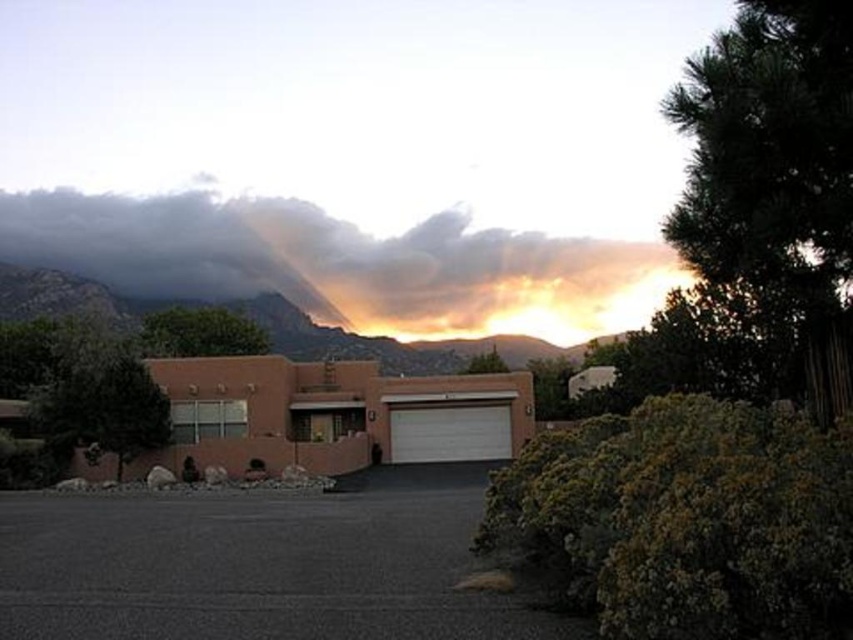
Does dark asphalt driveway at center have a larger size compared to rugged stone mountain at upper center?

No, dark asphalt driveway at center is not bigger than rugged stone mountain at upper center.

Between point (157, 561) and point (80, 292), which one is positioned behind?

Positioned behind is point (80, 292).

The width and height of the screenshot is (853, 640). Identify the location of dark asphalt driveway at center. (254, 566).

Image resolution: width=853 pixels, height=640 pixels. Find the location of `dark asphalt driveway at center`. dark asphalt driveway at center is located at coordinates (254, 566).

Is point (148, 632) farther from viewer compared to point (502, 445)?

No, (148, 632) is in front of (502, 445).

What do you see at coordinates (254, 566) in the screenshot? I see `dark asphalt driveway at center` at bounding box center [254, 566].

At what (x,y) coordinates should I click in order to perform the action: click on dark asphalt driveway at center. Please return your answer as a coordinate pair (x, y). The height and width of the screenshot is (640, 853). Looking at the image, I should click on (254, 566).

Is dark asphalt driveway at center positioned at the back of dark gray cloud at upper center?

No, it is not.

Does dark asphalt driveway at center appear over dark gray cloud at upper center?

Incorrect, dark asphalt driveway at center is not positioned above dark gray cloud at upper center.

The width and height of the screenshot is (853, 640). Describe the element at coordinates (254, 566) in the screenshot. I see `dark asphalt driveway at center` at that location.

This screenshot has height=640, width=853. In order to click on dark asphalt driveway at center in this screenshot , I will do `click(254, 566)`.